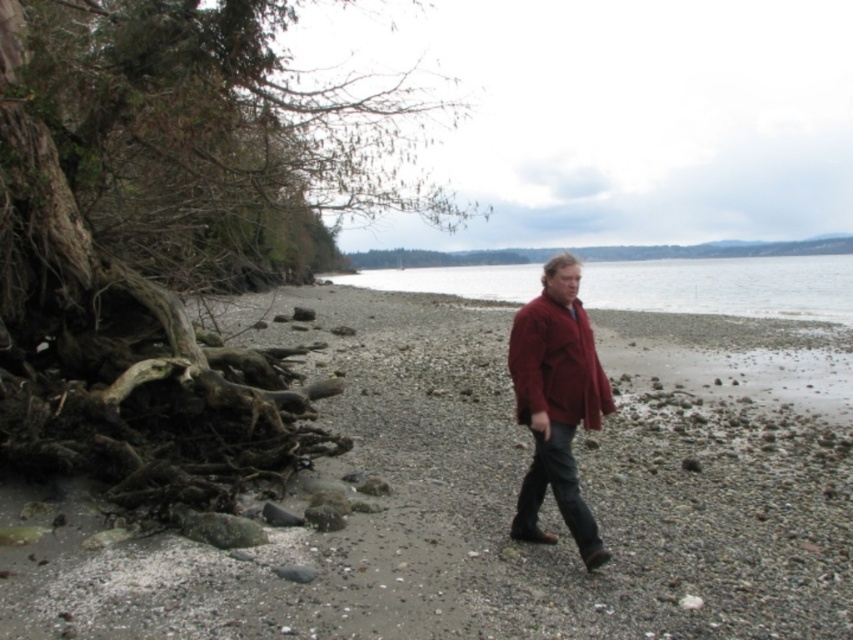
You are standing on the beach and want to place a 1 meter long wooden board between the brown textured roots at left and the dark brown driftwood at left. Can you fit it there without bending the board?

The distance between the brown textured roots at left and the dark brown driftwood at left is 1.15 meters, so yes, the 1 meter long wooden board can fit between them without bending since it is shorter than the available space.

You are standing at the point with coordinates point (726, 285). Looking around, you see a man walking towards the right side of the frame and a large tree with exposed roots to the left. Which direction should you walk to reach the man first?

You should walk towards the right side of the frame because the man is moving towards that direction and is already positioned to the right relative to your current position at point (726, 285).